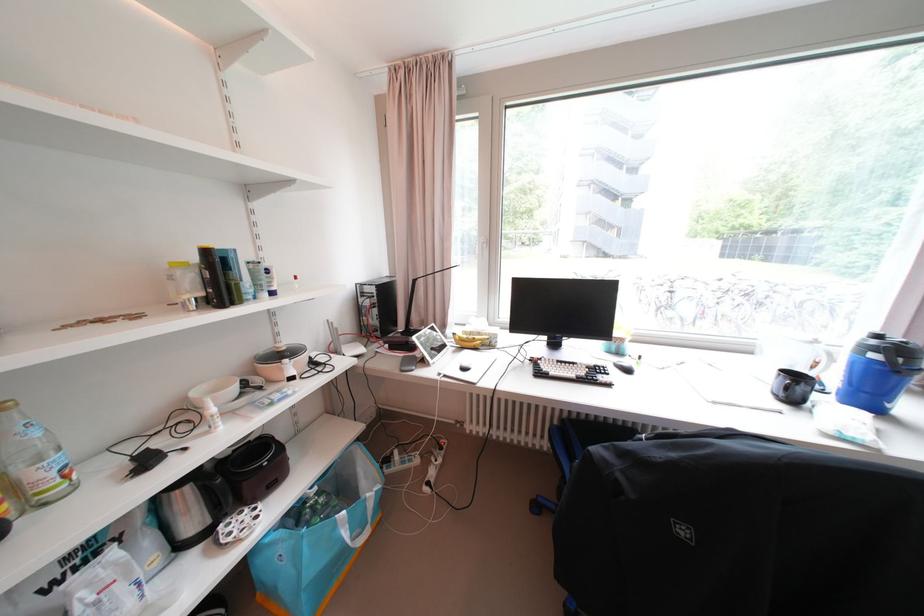
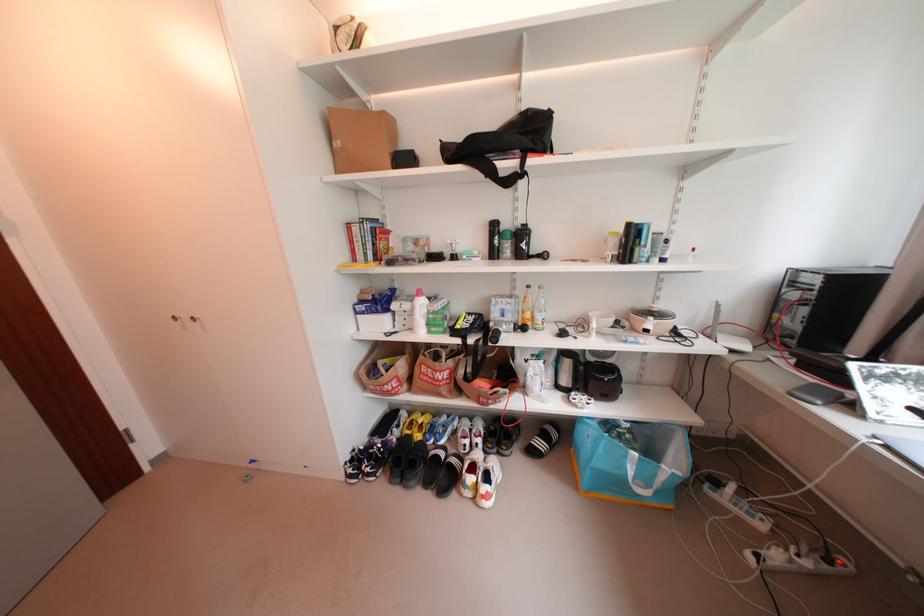
In the second image, find the point that corresponds to (x=442, y=461) in the first image.

(801, 552)